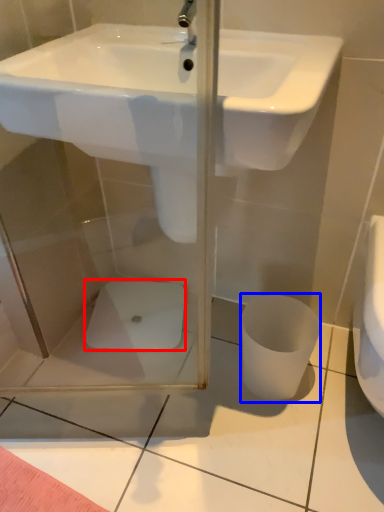
Question: Which point is closer to the camera, porcelain (highlighted by a red box) or toilet bowl (highlighted by a blue box)?

Choices:
 (A) porcelain
 (B) toilet bowl

Answer: (B)